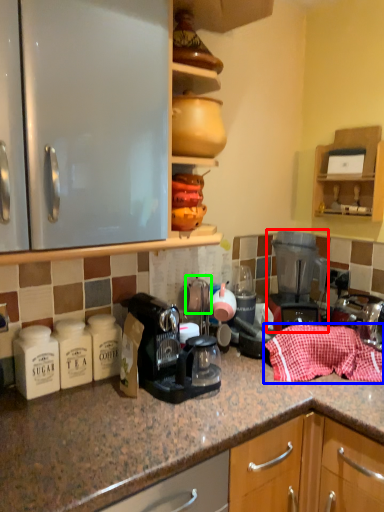
Question: Estimate the real-world distances between objects in this image. Which object is farther from home appliance (highlighted by a red box), material (highlighted by a blue box) or tea pot (highlighted by a green box)?

Choices:
 (A) material
 (B) tea pot

Answer: (B)